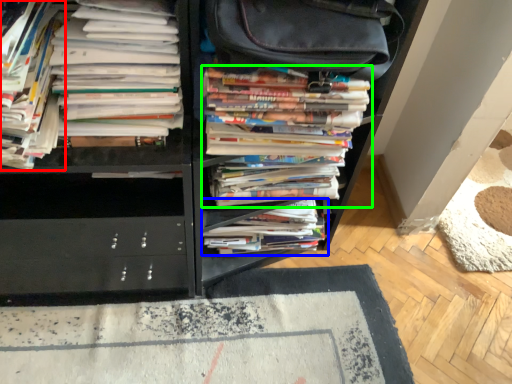
Question: Which is nearer to the book (highlighted by a red box)? book (highlighted by a blue box) or book (highlighted by a green box).

Choices:
 (A) book
 (B) book

Answer: (B)